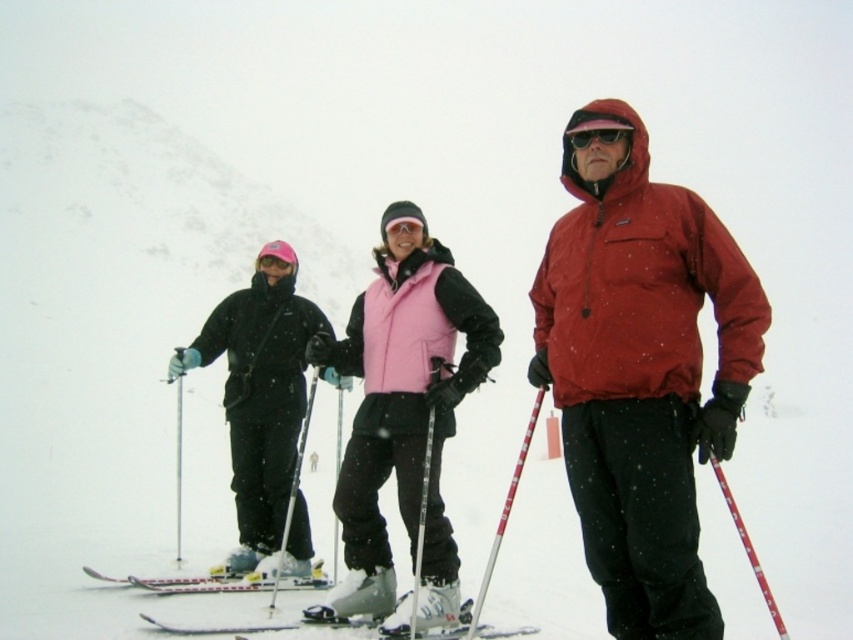
Question: Observing the image, what is the correct spatial positioning of matte black ski jacket at center in reference to pink fleece vest at center?

Choices:
 (A) above
 (B) below

Answer: (A)

Question: Is matte black ski jacket at center behind metallic silver ski pole at center?

Choices:
 (A) no
 (B) yes

Answer: (A)

Question: Among these objects, which one is nearest to the camera?

Choices:
 (A) clear plastic goggles at center
 (B) white plastic ski at center
 (C) matte red jacket at center

Answer: (C)

Question: Which point is closer to the camera taking this photo?

Choices:
 (A) (416, 259)
 (B) (480, 582)

Answer: (A)

Question: Estimate the real-world distances between objects in this image. Which object is farther from the matte red jacket at center?

Choices:
 (A) metallic silver ski pole at center
 (B) red plastic ski pole at center
 (C) white plastic ski at lower center
 (D) matte black ski jacket at center

Answer: (C)

Question: In this image, where is pink fleece vest at center located relative to white plastic ski at lower center?

Choices:
 (A) left
 (B) right

Answer: (B)